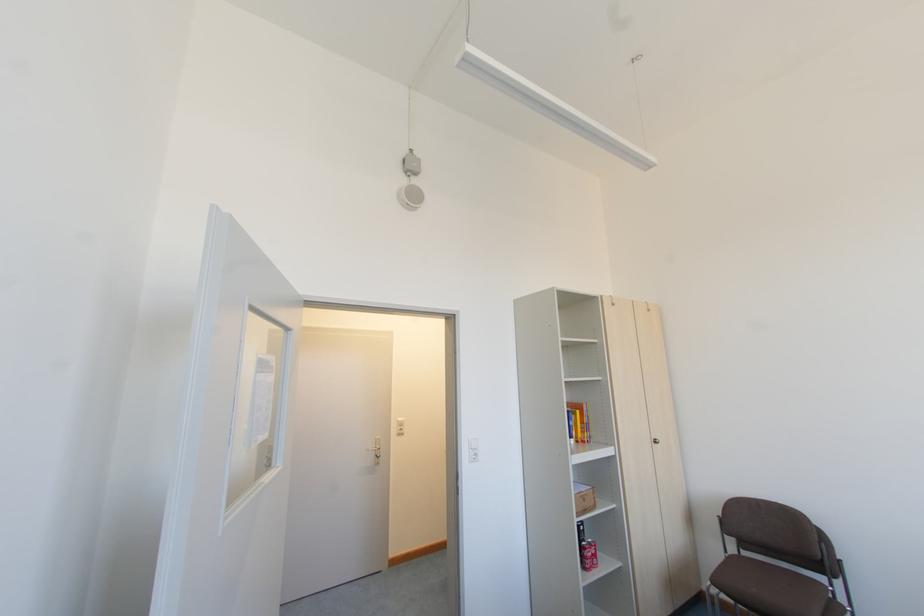
This screenshot has width=924, height=616. What do you see at coordinates (473, 448) in the screenshot?
I see `a white light switch` at bounding box center [473, 448].